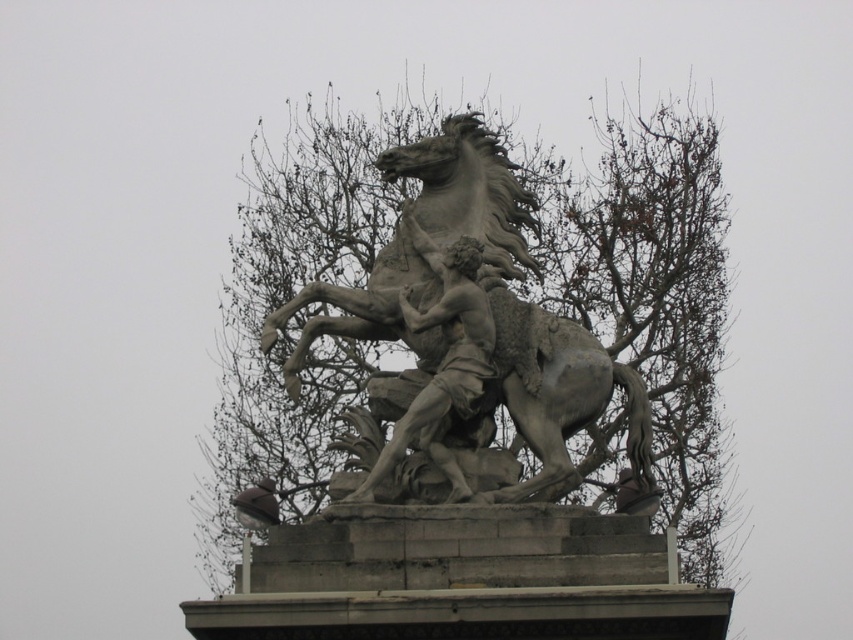
Which is behind, point (437, 538) or point (408, 419)?

The point (408, 419) is behind.

Image resolution: width=853 pixels, height=640 pixels. Find the location of `bare branches at upper center`. bare branches at upper center is located at coordinates (474, 513).

How far apart are gray stone horse at center and smooth gray statue at center?

gray stone horse at center is 23.52 feet from smooth gray statue at center.

Who is lower down, gray stone horse at center or smooth gray statue at center?

smooth gray statue at center is below.

What do you see at coordinates (467, 193) in the screenshot?
I see `gray stone horse at center` at bounding box center [467, 193].

The height and width of the screenshot is (640, 853). I want to click on gray stone horse at center, so click(467, 193).

Locate an element on the screen. The height and width of the screenshot is (640, 853). bare branches at upper center is located at coordinates (474, 513).

Which is behind, point (403, 486) or point (512, 252)?

Point (512, 252)

At what (x,y) coordinates should I click in order to perform the action: click on bare branches at upper center. Please return your answer as a coordinate pair (x, y). Looking at the image, I should click on (474, 513).